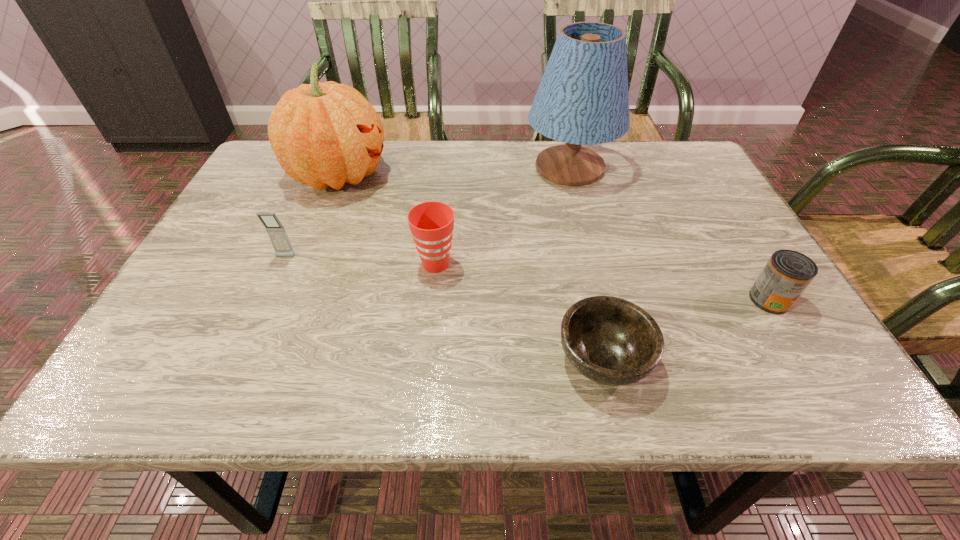
Where is `the tallest object`? The image size is (960, 540). the tallest object is located at coordinates (582, 99).

Image resolution: width=960 pixels, height=540 pixels. In order to click on the second tallest object in this screenshot , I will do `click(326, 134)`.

In order to click on cellular telephone in this screenshot , I will do `click(276, 232)`.

The height and width of the screenshot is (540, 960). I want to click on cup, so click(431, 223).

I want to click on the fifth tallest object, so click(787, 274).

This screenshot has height=540, width=960. What are the coordinates of `the rightmost object` in the screenshot? It's located at [x=787, y=274].

The image size is (960, 540). In order to click on bowl in this screenshot , I will do `click(609, 340)`.

Identify the location of the shortest object. This screenshot has width=960, height=540. (609, 340).

The width and height of the screenshot is (960, 540). What are the coordinates of `vacant space located 0.060m on the front of the tallest object` in the screenshot? It's located at (581, 209).

Where is `vacant area situated on the carved face of the pumpkin`? The height and width of the screenshot is (540, 960). vacant area situated on the carved face of the pumpkin is located at coordinates (526, 176).